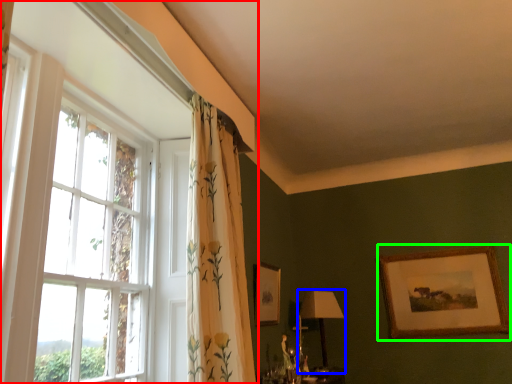
Question: Which is nearer to the window (highlighted by a red box)? table lamp (highlighted by a blue box) or picture frame (highlighted by a green box).

Choices:
 (A) table lamp
 (B) picture frame

Answer: (A)